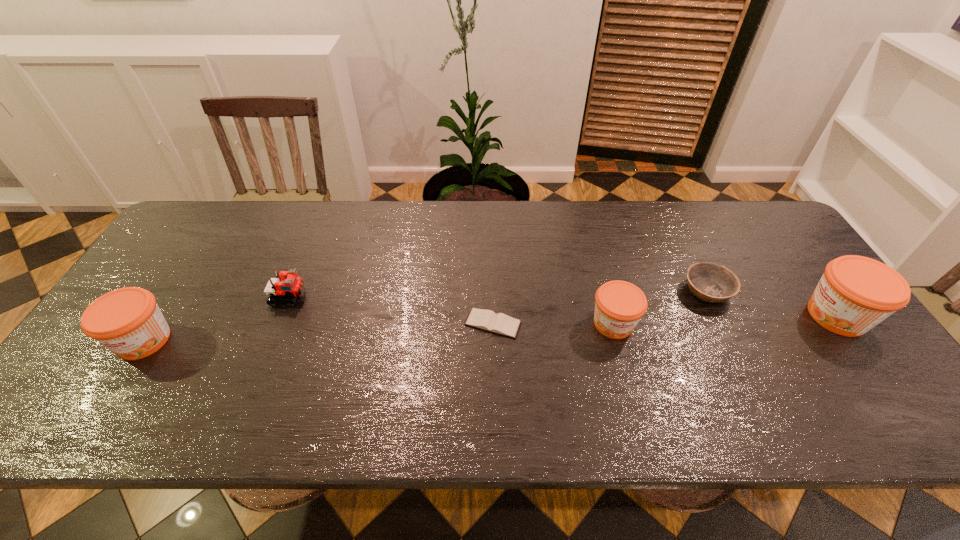
I want to click on vacant position for inserting another jam evenly, so click(x=382, y=332).